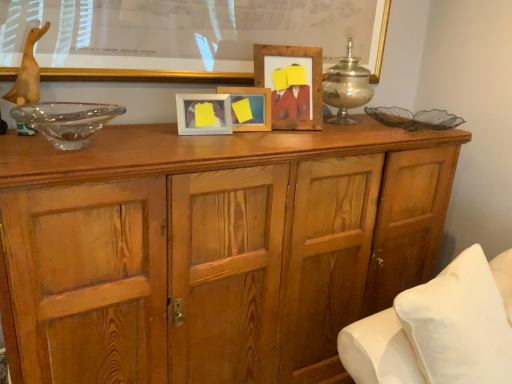
This screenshot has width=512, height=384. Identify the location of vacant space in transparent glass bowl at left (from a real-world perspective). coord(49,141).